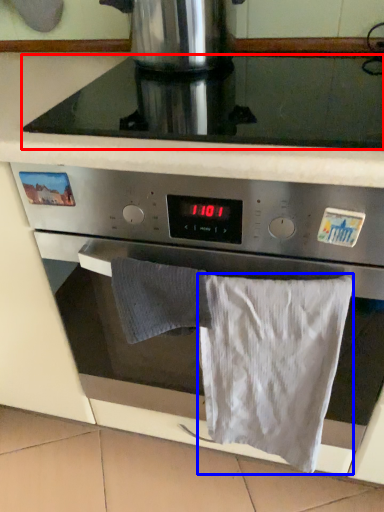
Question: Which object appears farthest to the camera in this image, gas stove (highlighted by a red box) or bath towel (highlighted by a blue box)?

Choices:
 (A) gas stove
 (B) bath towel

Answer: (B)